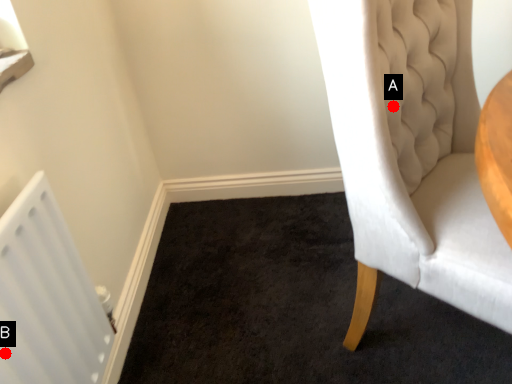
Question: Two points are circled on the image, labeled by A and B beside each circle. Which of the following is the closest to the observer?

Choices:
 (A) A is closer
 (B) B is closer

Answer: (B)